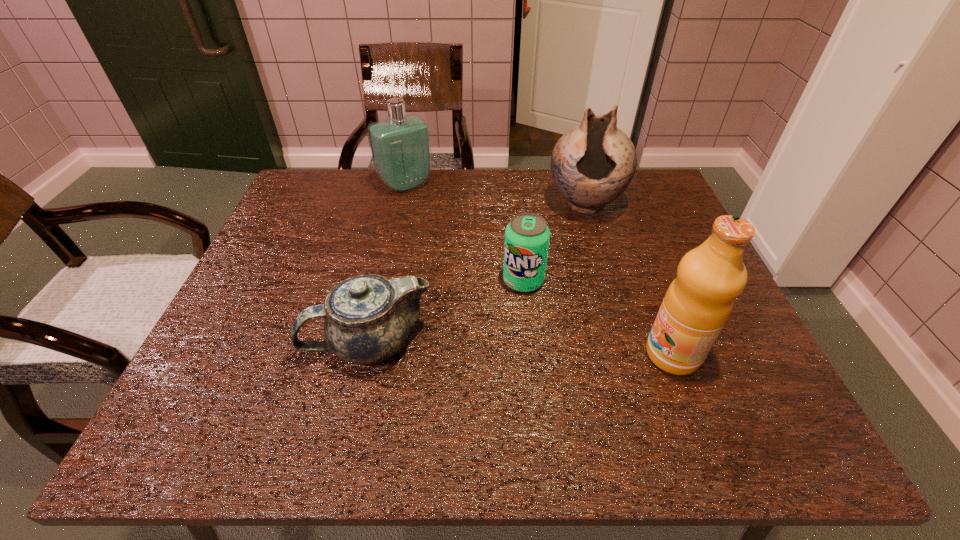
This screenshot has height=540, width=960. I want to click on free space at the left edge, so click(276, 354).

I want to click on vacant space at the right edge of the desktop, so click(x=639, y=252).

Locate an element on the screen. This screenshot has height=540, width=960. free region at the near left corner of the desktop is located at coordinates (186, 395).

What are the coordinates of `vacant space at the far right corner` in the screenshot? It's located at (634, 213).

Identify the location of empty location between the pottery and the third object from left to right. (554, 242).

Find the location of a particular element. The image size is (960, 540). free space between the pottery and the third nearest object is located at coordinates (554, 242).

Locate an element on the screen. The width and height of the screenshot is (960, 540). free space between the chinaware and the third shortest object is located at coordinates (388, 264).

At what (x,y) coordinates should I click in order to perform the action: click on free space that is in between the chinaware and the pottery. Please return your answer as a coordinate pair (x, y). Image resolution: width=960 pixels, height=540 pixels. Looking at the image, I should click on (477, 273).

Locate an element on the screen. The width and height of the screenshot is (960, 540). free space that is in between the chinaware and the pop soda is located at coordinates click(446, 311).

The width and height of the screenshot is (960, 540). In order to click on vacant space in between the chinaware and the fruit juice in this screenshot , I will do `click(521, 348)`.